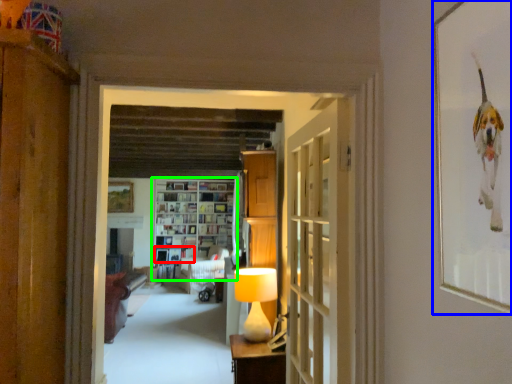
Question: Estimate the real-world distances between objects in this image. Which object is closer to book (highlighted by a red box), picture frame (highlighted by a blue box) or shelf (highlighted by a green box)?

Choices:
 (A) picture frame
 (B) shelf

Answer: (B)